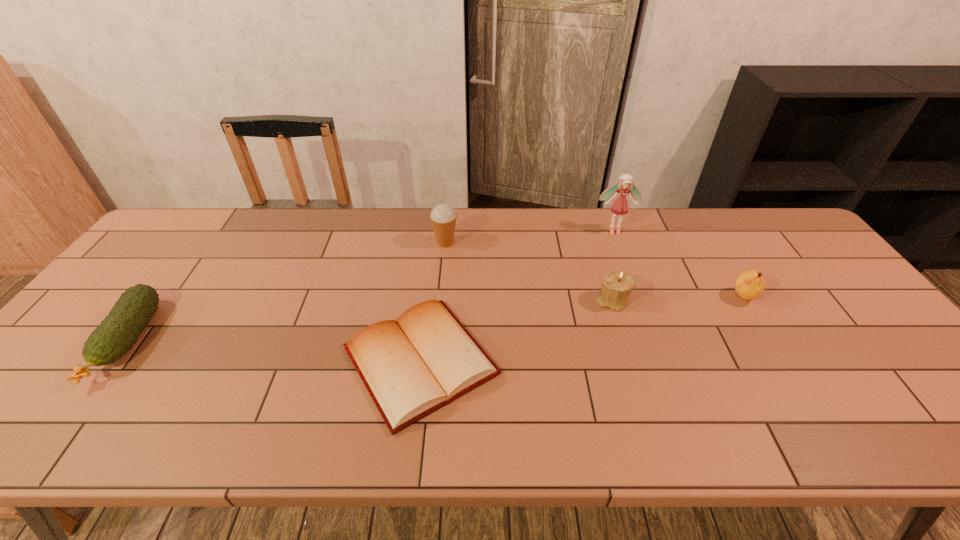
Where is `free region located on the front of the pear`? The image size is (960, 540). free region located on the front of the pear is located at coordinates (828, 436).

The width and height of the screenshot is (960, 540). Identify the location of vacant space located 0.120m at the blossom end of the leftmost object. (52, 442).

I want to click on vacant space situated on the back of the shortest object, so point(434,249).

Locate an element on the screen. This screenshot has height=540, width=960. doll at the far edge is located at coordinates (620, 206).

Locate an element on the screen. This screenshot has height=540, width=960. icecream situated at the far edge is located at coordinates (443, 217).

You are a GUI agent. You are given a task and a screenshot of the screen. Output one action in this format:
    pyautogui.click(x=<x>, y=<y>)
    Task: Click on the object that is at the near edge
    The image size is (960, 540).
    Given the screenshot: What is the action you would take?
    pyautogui.click(x=411, y=367)

The image size is (960, 540). What are the coordinates of `object that is at the left edge` in the screenshot? It's located at (118, 332).

In the image, there is a desktop. At what (x,y) coordinates should I click in order to perform the action: click on vacant area at the far edge. Please return your answer as a coordinate pair (x, y). The width and height of the screenshot is (960, 540). Looking at the image, I should click on (574, 216).

Find the location of a particular element. This screenshot has width=960, height=540. free location at the near edge of the desktop is located at coordinates (245, 427).

Locate an element on the screen. The image size is (960, 540). vacant space at the left edge of the desktop is located at coordinates (72, 353).